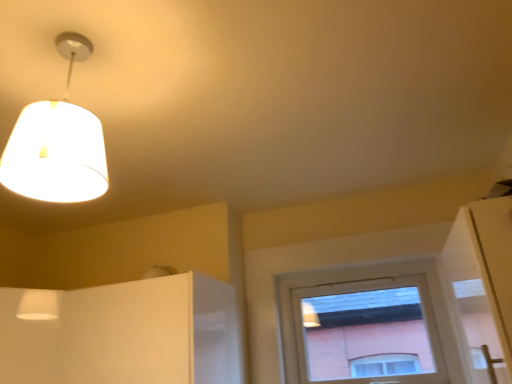
Locate an element on the screen. This screenshot has height=384, width=512. matte white window at center is located at coordinates (365, 325).

This screenshot has width=512, height=384. What do you see at coordinates (126, 334) in the screenshot?
I see `white glossy cabinet at lower left` at bounding box center [126, 334].

Where is `matte white window at center`? This screenshot has width=512, height=384. matte white window at center is located at coordinates (365, 325).

From the image's perspective, does matte white window at center appear higher than white fabric lampshade at upper left?

No, from the image's perspective, matte white window at center is not above white fabric lampshade at upper left.

Between matte white window at center and white fabric lampshade at upper left, which one has larger size?

With larger size is matte white window at center.

Considering the relative positions of matte white window at center and white fabric lampshade at upper left in the image provided, is matte white window at center behind white fabric lampshade at upper left?

Yes, the depth of matte white window at center is greater than that of white fabric lampshade at upper left.

Considering the relative positions of white glossy cabinet at lower left and white fabric lampshade at upper left in the image provided, is white glossy cabinet at lower left to the right of white fabric lampshade at upper left from the viewer's perspective?

Correct, you'll find white glossy cabinet at lower left to the right of white fabric lampshade at upper left.

Consider the image. Which of these two, white glossy cabinet at lower left or white fabric lampshade at upper left, is smaller?

Smaller between the two is white fabric lampshade at upper left.

Can you tell me how much white glossy cabinet at lower left and white fabric lampshade at upper left differ in facing direction?

They differ by 2.47 degrees in their facing directions.

Which object is thinner, white glossy cabinet at lower left or white fabric lampshade at upper left?

With smaller width is white fabric lampshade at upper left.

From a real-world perspective, is matte white window at center physically located above or below white glossy cabinet at lower left?

matte white window at center is situated higher than white glossy cabinet at lower left in the real world.

Can you confirm if matte white window at center is shorter than white glossy cabinet at lower left?

No.

From the image's perspective, would you say matte white window at center is shown under white glossy cabinet at lower left?

Yes, from the image's perspective, matte white window at center is below white glossy cabinet at lower left.

Considering the relative sizes of matte white window at center and white glossy cabinet at lower left in the image provided, is matte white window at center thinner than white glossy cabinet at lower left?

Yes.

Are white fabric lampshade at upper left and white glossy cabinet at lower left making contact?

No, white fabric lampshade at upper left is not with white glossy cabinet at lower left.

Considering the sizes of white fabric lampshade at upper left and white glossy cabinet at lower left in the image, is white fabric lampshade at upper left taller or shorter than white glossy cabinet at lower left?

Clearly, white fabric lampshade at upper left is shorter compared to white glossy cabinet at lower left.

Is white fabric lampshade at upper left bigger or smaller than white glossy cabinet at lower left?

In the image, white fabric lampshade at upper left appears to be smaller than white glossy cabinet at lower left.

This screenshot has width=512, height=384. I want to click on window behind the white glossy cabinet at lower left, so click(x=365, y=325).

Are white glossy cabinet at lower left and matte white window at center beside each other?

white glossy cabinet at lower left is not next to matte white window at center, and they're not touching.

Which is less distant, (141, 298) or (375, 381)?

Point (141, 298).

From the image's perspective, does white fabric lampshade at upper left appear higher than matte white window at center?

Yes, from the image's perspective, white fabric lampshade at upper left is on top of matte white window at center.

Between white fabric lampshade at upper left and matte white window at center, which one has smaller size?

white fabric lampshade at upper left.

Would you say white fabric lampshade at upper left is inside or outside matte white window at center?

white fabric lampshade at upper left is not inside matte white window at center, it's outside.

Where is `window below the white fabric lampshade at upper left (from a real-world perspective)`? The image size is (512, 384). window below the white fabric lampshade at upper left (from a real-world perspective) is located at coordinates (365, 325).

Image resolution: width=512 pixels, height=384 pixels. I want to click on cabinetry behind the white fabric lampshade at upper left, so click(x=126, y=334).

Considering their positions, is matte white window at center positioned closer to white fabric lampshade at upper left than white glossy cabinet at lower left?

Based on the image, white glossy cabinet at lower left appears to be nearer to white fabric lampshade at upper left.

Considering their positions, is white glossy cabinet at lower left positioned further to matte white window at center than white fabric lampshade at upper left?

Based on the image, white fabric lampshade at upper left appears to be further to matte white window at center.

Looking at the image, which one is located further to white glossy cabinet at lower left, matte white window at center or white fabric lampshade at upper left?

matte white window at center lies further to white glossy cabinet at lower left than the other object.

Based on their spatial positions, is white fabric lampshade at upper left or matte white window at center further from white glossy cabinet at lower left?

Based on the image, matte white window at center appears to be further to white glossy cabinet at lower left.

Based on their spatial positions, is white fabric lampshade at upper left or white glossy cabinet at lower left closer to matte white window at center?

Among the two, white glossy cabinet at lower left is located nearer to matte white window at center.

Considering their positions, is white glossy cabinet at lower left positioned further to white fabric lampshade at upper left than matte white window at center?

Among the two, matte white window at center is located further to white fabric lampshade at upper left.

Find the location of a particular element. The width and height of the screenshot is (512, 384). cabinetry between white fabric lampshade at upper left and matte white window at center from left to right is located at coordinates (126, 334).